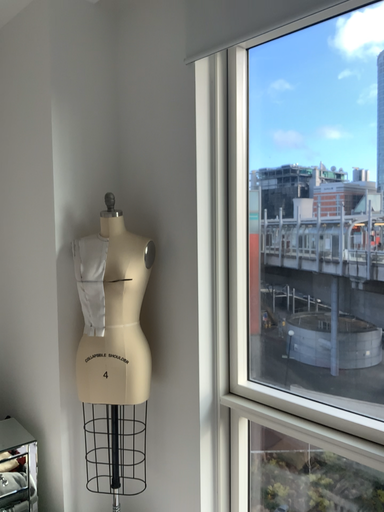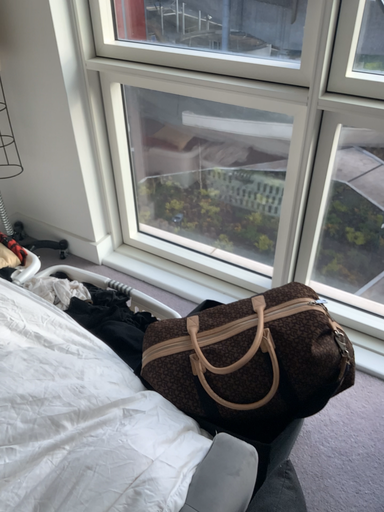
Question: How did the camera likely rotate when shooting the video?

Choices:
 (A) rotated upward
 (B) rotated downward

Answer: (B)